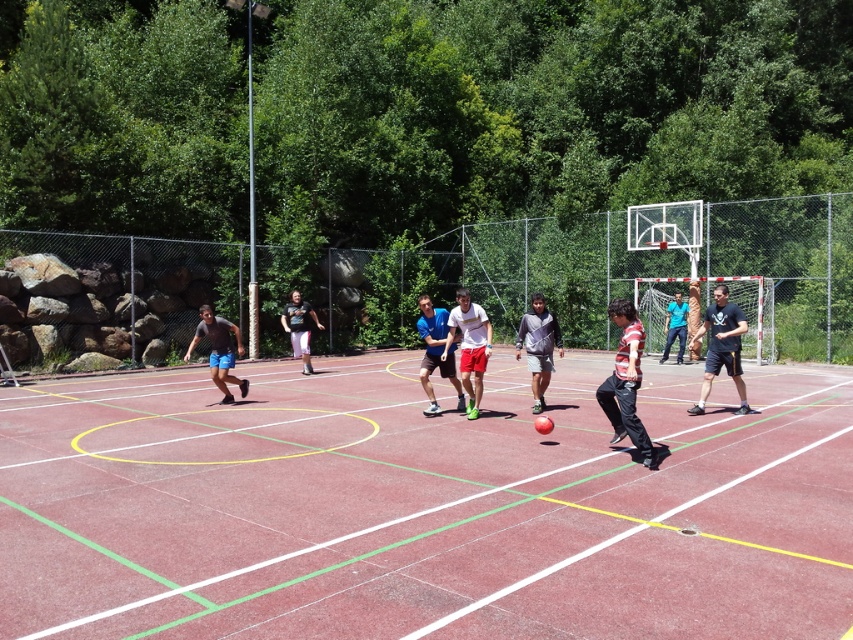
Question: Among these points, which one is nearest to the camera?

Choices:
 (A) (439, 339)
 (B) (479, 396)
 (C) (676, 355)

Answer: (A)

Question: Does striped cotton shirt at center appear under blue t-shirt at center?

Choices:
 (A) no
 (B) yes

Answer: (B)

Question: Which point is closer to the camera?

Choices:
 (A) (735, 374)
 (B) (296, 336)
 (C) (223, 394)

Answer: (A)

Question: Which of the following is the closest to the observer?

Choices:
 (A) (440, 317)
 (B) (548, 358)
 (C) (704, 314)

Answer: (A)

Question: Does striped cotton shirt at center have a smaller size compared to blue t-shirt at center?

Choices:
 (A) yes
 (B) no

Answer: (B)

Question: Is red rubber basketball court at center wider than white matte shorts at center?

Choices:
 (A) no
 (B) yes

Answer: (B)